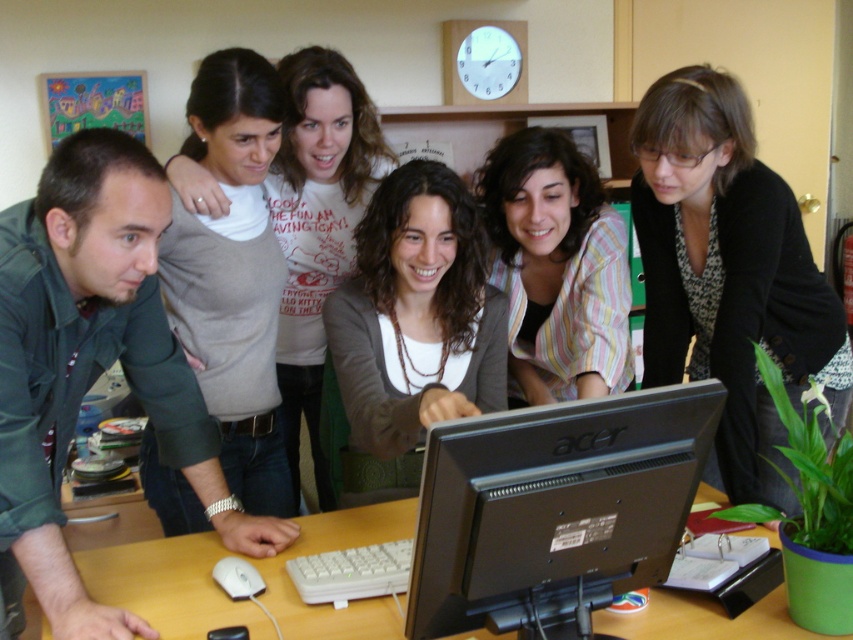
Is matte gray sweater at center positioned at the back of wooden table at center?

Yes, matte gray sweater at center is behind wooden table at center.

What do you see at coordinates (233, 275) in the screenshot? This screenshot has height=640, width=853. I see `matte gray sweater at center` at bounding box center [233, 275].

What do you see at coordinates (233, 275) in the screenshot?
I see `matte gray sweater at center` at bounding box center [233, 275].

You are a GUI agent. You are given a task and a screenshot of the screen. Output one action in this format:
    pyautogui.click(x=<x>, y=<y>)
    Task: Click on the matte gray sweater at center
    The width and height of the screenshot is (853, 640).
    Given the screenshot: What is the action you would take?
    pyautogui.click(x=233, y=275)

Who is positioned more to the right, black textured blazer at center or brown matte sweater at center?

From the viewer's perspective, black textured blazer at center appears more on the right side.

Between black textured blazer at center and brown matte sweater at center, which one has less height?

With less height is brown matte sweater at center.

The width and height of the screenshot is (853, 640). Describe the element at coordinates (729, 275) in the screenshot. I see `black textured blazer at center` at that location.

Locate an element on the screen. black textured blazer at center is located at coordinates (729, 275).

Can you confirm if white t-shirt at center is wider than white matte mouse at lower left?

Yes.

Which is more to the left, white t-shirt at center or white matte mouse at lower left?

white matte mouse at lower left

Which is behind, point (204, 196) or point (259, 577)?

Positioned behind is point (204, 196).

This screenshot has width=853, height=640. I want to click on white t-shirt at center, so click(318, 237).